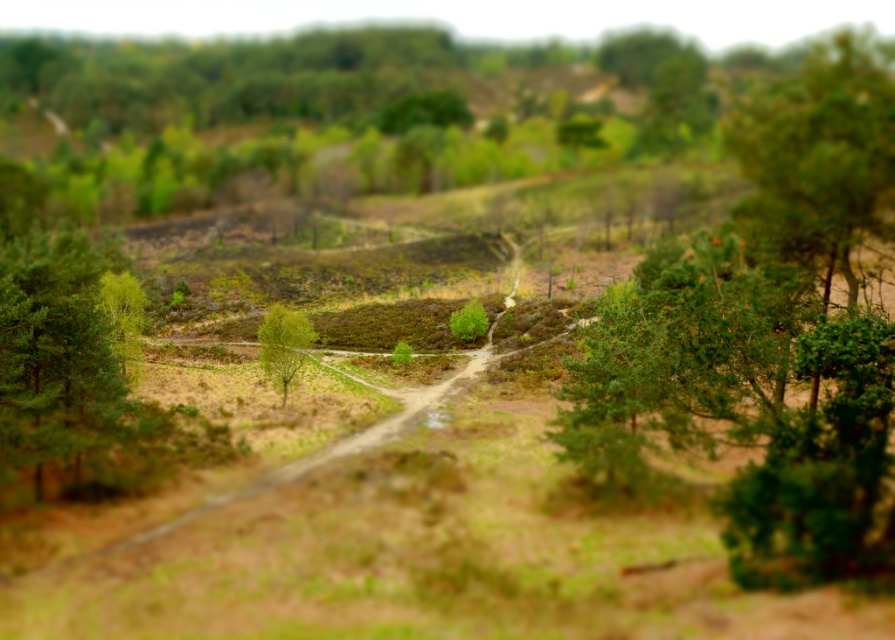
You are a hiker trying to decide which tree to rest under. You prefer a larger tree for shade. Which tree should you choose between the green matte tree at right and the green leafy tree at center?

The green matte tree at right is bigger than the green leafy tree at center, so you should choose the green matte tree at right for shade.

You are standing on the dirt path in the foreground of the landscape. You see the green matte tree at right and the green leafy tree at center. Which tree is positioned higher relative to the other?

The green matte tree at right is located above the green leafy tree at center, so it is positioned higher.